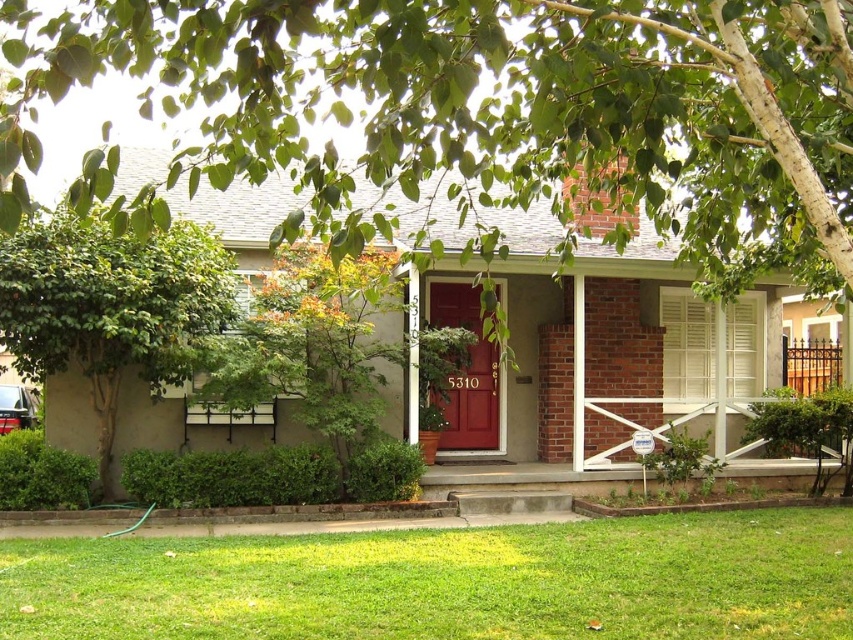
Question: Estimate the real-world distances between objects in this image. Which object is farther from the green grass at lower center?

Choices:
 (A) matte red door at center
 (B) green leafy tree at upper center

Answer: (A)

Question: Which point is closer to the camera?

Choices:
 (A) (468, 317)
 (B) (99, 312)
 (C) (427, 176)

Answer: (C)

Question: Where is green leafy tree at upper center located in relation to green leafy tree at left in the image?

Choices:
 (A) below
 (B) above

Answer: (B)

Question: Does green leafy tree at upper center appear over green leafy tree at left?

Choices:
 (A) yes
 (B) no

Answer: (A)

Question: Which point is farther to the camera?

Choices:
 (A) green grass at lower center
 (B) green leafy tree at left

Answer: (B)

Question: Can you confirm if green leafy tree at upper center is thinner than green grass at lower center?

Choices:
 (A) no
 (B) yes

Answer: (B)